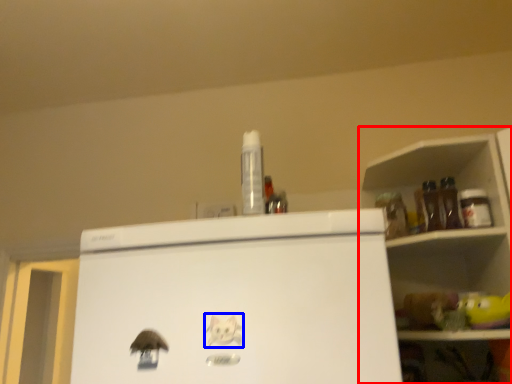
Question: Which object appears farthest to the camera in this image, shelf (highlighted by a red box) or animal (highlighted by a blue box)?

Choices:
 (A) shelf
 (B) animal

Answer: (A)